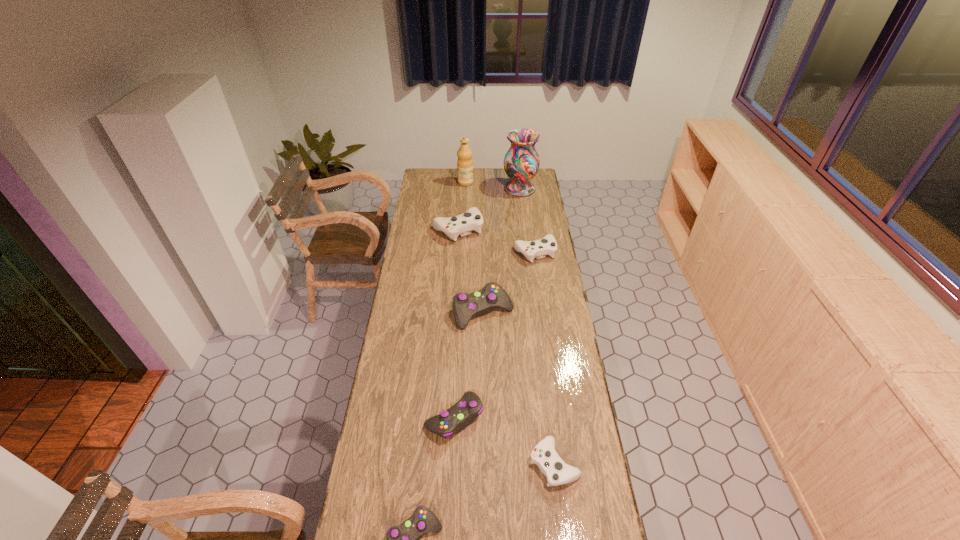
The image size is (960, 540). What are the coordinates of `free space located 0.200m on the front of the biggest white control` in the screenshot? It's located at click(455, 269).

You are a GUI agent. You are given a task and a screenshot of the screen. Output one action in this format:
    pyautogui.click(x=<x>, y=<y>)
    Task: Click on the vacant space located on the front of the third farthest control
    
    Given the screenshot: What is the action you would take?
    click(484, 350)

The height and width of the screenshot is (540, 960). I want to click on vacant area situated 0.270m on the back of the second smallest white control, so click(x=529, y=211).

In order to click on blank space located 0.160m on the front of the second nearest gray control in this screenshot , I will do 451,493.

Locate an element on the screen. This screenshot has height=540, width=960. vacant area located on the back of the nearest white control is located at coordinates (549, 418).

This screenshot has height=540, width=960. Identify the location of vase that is at the far edge. (521, 162).

You are a GUI agent. You are given a task and a screenshot of the screen. Output one action in this format:
    pyautogui.click(x=<x>, y=<y>)
    Task: Click on the olive oil present at the far edge
    The height and width of the screenshot is (540, 960).
    Given the screenshot: What is the action you would take?
    pyautogui.click(x=464, y=162)

I want to click on object that is at the left edge, so click(x=463, y=224).

Image resolution: width=960 pixels, height=540 pixels. What are the coordinates of `vase located at the right edge` in the screenshot? It's located at (521, 162).

What are the coordinates of `object that is at the far right corner` in the screenshot? It's located at (521, 162).